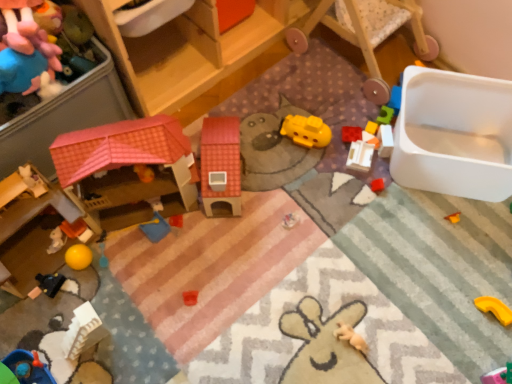
At what (x,y) coordinates should I click in order to perform the action: click on free space between rubber brick at upper right, placed as the 7th toy when sorted from left to right, and black matte toy car at lower left, the tenth toy viewed from the right. Please return your answer as a coordinate pair (x, y). Looking at the image, I should click on (225, 209).